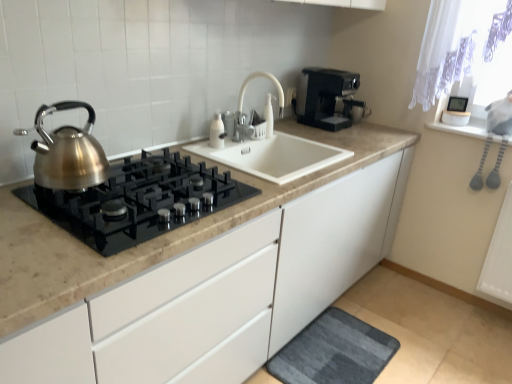
Question: From a real-world perspective, is satin metallic gas stove at left beneath black plastic coffee maker at upper right?

Choices:
 (A) yes
 (B) no

Answer: (A)

Question: Would you say black plastic coffee maker at upper right is part of satin metallic gas stove at left's contents?

Choices:
 (A) yes
 (B) no

Answer: (B)

Question: Can you confirm if satin metallic gas stove at left is taller than black plastic coffee maker at upper right?

Choices:
 (A) yes
 (B) no

Answer: (B)

Question: Does satin metallic gas stove at left turn towards black plastic coffee maker at upper right?

Choices:
 (A) yes
 (B) no

Answer: (B)

Question: From the image's perspective, is satin metallic gas stove at left above black plastic coffee maker at upper right?

Choices:
 (A) no
 (B) yes

Answer: (A)

Question: Is black plastic coffee maker at upper right situated inside brushed metal kettle at left or outside?

Choices:
 (A) inside
 (B) outside

Answer: (B)

Question: From the image's perspective, is black plastic coffee maker at upper right positioned above or below brushed metal kettle at left?

Choices:
 (A) above
 (B) below

Answer: (A)

Question: From a real-world perspective, relative to brushed metal kettle at left, is black plastic coffee maker at upper right vertically above or below?

Choices:
 (A) above
 (B) below

Answer: (B)

Question: Considering the relative positions of black plastic coffee maker at upper right and brushed metal kettle at left in the image provided, is black plastic coffee maker at upper right to the left or to the right of brushed metal kettle at left?

Choices:
 (A) right
 (B) left

Answer: (A)

Question: Is dark gray textured bath mat at lower center in front of or behind brushed metal kettle at left in the image?

Choices:
 (A) front
 (B) behind

Answer: (B)

Question: Is dark gray textured bath mat at lower center taller or shorter than brushed metal kettle at left?

Choices:
 (A) short
 (B) tall

Answer: (A)

Question: From a real-world perspective, is dark gray textured bath mat at lower center physically located above or below brushed metal kettle at left?

Choices:
 (A) above
 (B) below

Answer: (B)

Question: Based on their sizes in the image, would you say dark gray textured bath mat at lower center is bigger or smaller than brushed metal kettle at left?

Choices:
 (A) small
 (B) big

Answer: (B)

Question: From the image's perspective, is satin metallic gas stove at left positioned above or below black plastic coffee maker at upper right?

Choices:
 (A) above
 (B) below

Answer: (B)

Question: Considering the positions of satin metallic gas stove at left and black plastic coffee maker at upper right in the image, is satin metallic gas stove at left wider or thinner than black plastic coffee maker at upper right?

Choices:
 (A) wide
 (B) thin

Answer: (A)